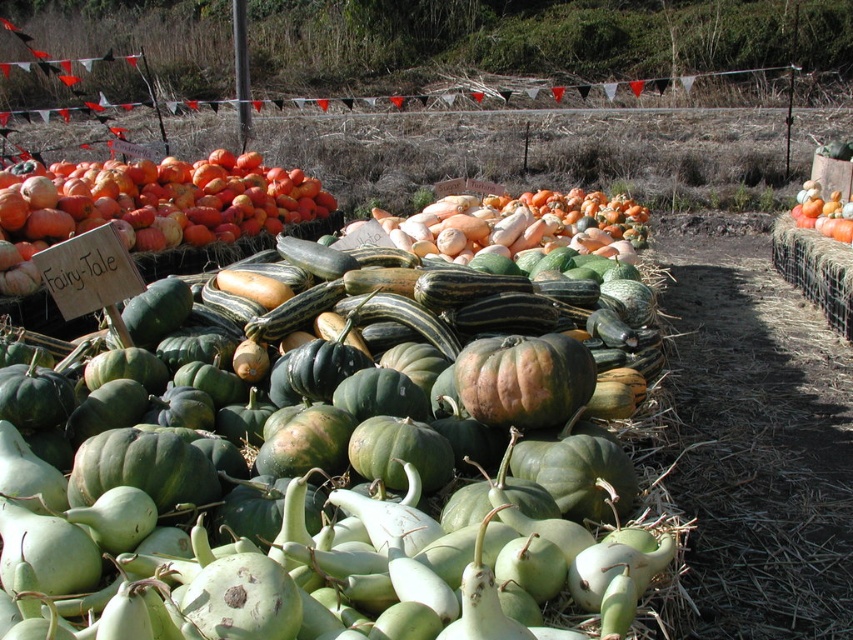
Is point (425, 576) farther from camera compared to point (846, 225)?

No, (425, 576) is closer to viewer.

Does green matte gourd at center come in front of orange matte pumpkin at center?

Yes.

Is point (305, 634) less distant than point (811, 205)?

Yes, it is.

Locate an element on the screen. This screenshot has height=640, width=853. green matte gourd at center is located at coordinates (323, 468).

What do you see at coordinates (323, 468) in the screenshot? This screenshot has height=640, width=853. I see `green matte gourd at center` at bounding box center [323, 468].

Consider the image. Who is positioned more to the right, green matte gourd at center or smooth orange squash at center?

smooth orange squash at center is more to the right.

Between point (556, 332) and point (543, 193), which one is positioned behind?

Positioned behind is point (543, 193).

You are a GUI agent. You are given a task and a screenshot of the screen. Output one action in this format:
    pyautogui.click(x=<x>, y=<y>)
    Task: Click on the green matte gourd at center
    The height and width of the screenshot is (640, 853).
    Given the screenshot: What is the action you would take?
    [323, 468]

Is smooth orange squash at center smaller than rough textured pumpkin at center?

Actually, smooth orange squash at center might be larger than rough textured pumpkin at center.

Between point (624, 205) and point (543, 368), which one is positioned behind?

The point (624, 205) is behind.

Looking at this image, measure the distance between point [447,209] and camera.

13.88 feet

The height and width of the screenshot is (640, 853). I want to click on smooth orange squash at center, so click(x=520, y=225).